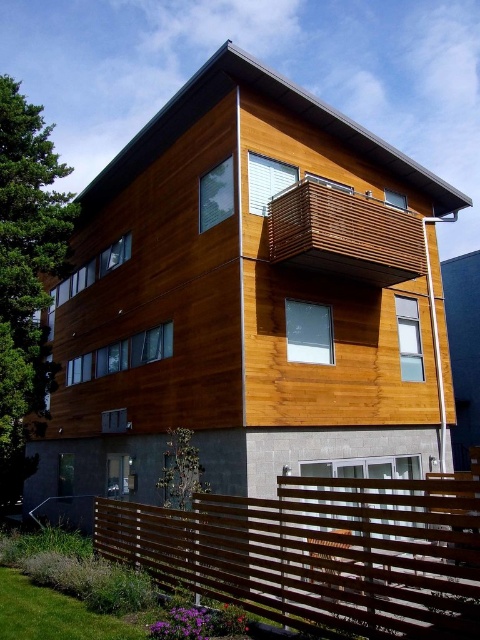
Question: Considering the relative positions of brown wooden fence at lower center and wooden slats balcony at upper center in the image provided, where is brown wooden fence at lower center located with respect to wooden slats balcony at upper center?

Choices:
 (A) left
 (B) right

Answer: (A)

Question: Which of the following is the closest to the observer?

Choices:
 (A) brown wooden fence at lower center
 (B) wooden slats balcony at upper center

Answer: (A)

Question: Can you confirm if brown wooden fence at lower center is positioned to the right of wooden slats balcony at upper center?

Choices:
 (A) yes
 (B) no

Answer: (B)

Question: Which point appears closest to the camera in this image?

Choices:
 (A) (354, 268)
 (B) (179, 541)

Answer: (B)

Question: Does brown wooden fence at lower center have a greater width compared to wooden slats balcony at upper center?

Choices:
 (A) no
 (B) yes

Answer: (B)

Question: Among these points, which one is nearest to the camera?

Choices:
 (A) (282, 228)
 (B) (247, 540)

Answer: (B)